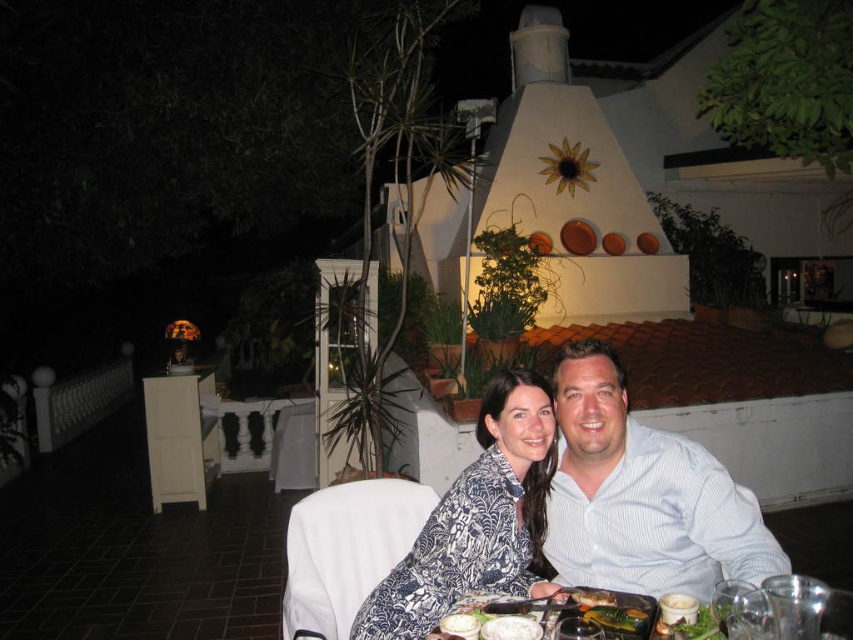
Is point (694, 452) behind point (422, 528)?

No, (694, 452) is in front of (422, 528).

Who is more forward, (761,545) or (543,467)?

Point (761,545)

Locate an element on the screen. white striped shirt at center is located at coordinates (642, 497).

Which is above, blue printed dress at center or shiny metallic fork at lower center?

Positioned higher is shiny metallic fork at lower center.

This screenshot has width=853, height=640. Find the location of `blue printed dress at center`. blue printed dress at center is located at coordinates (477, 518).

Does white striped shirt at center appear under shiny metallic fork at lower center?

Incorrect, white striped shirt at center is not positioned below shiny metallic fork at lower center.

Where is `white striped shirt at center`? This screenshot has width=853, height=640. white striped shirt at center is located at coordinates (642, 497).

Is point (654, 534) closer to camera compared to point (585, 595)?

That is False.

Find the location of a particular element. This screenshot has height=640, width=853. white striped shirt at center is located at coordinates (642, 497).